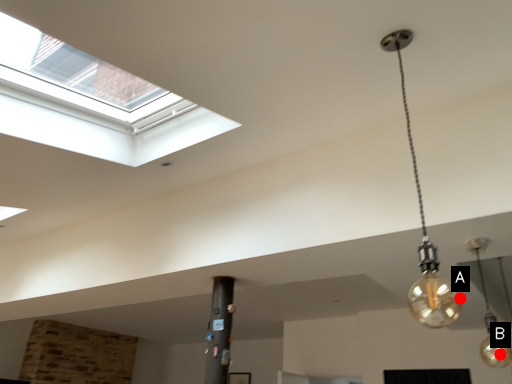
Question: Two points are circled on the image, labeled by A and B beside each circle. Which point is closer to the camera?

Choices:
 (A) A is closer
 (B) B is closer

Answer: (A)